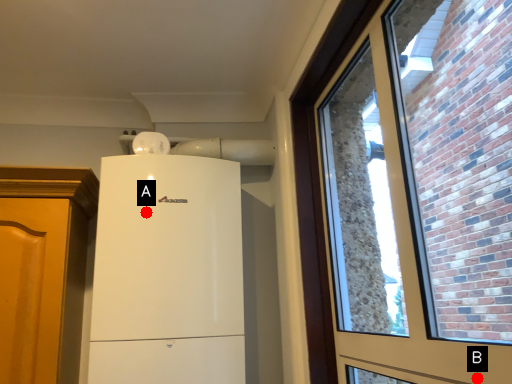
Question: Two points are circled on the image, labeled by A and B beside each circle. Among these points, which one is farthest from the camera?

Choices:
 (A) A is further
 (B) B is further

Answer: (A)